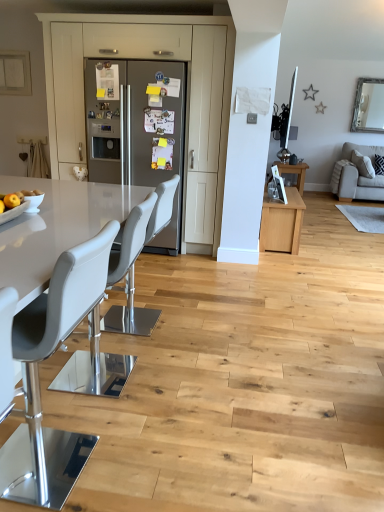
Question: Is white leather chair at center, the 1th chair viewed from the back, inside or outside of matte gray cabinet at center?

Choices:
 (A) inside
 (B) outside

Answer: (B)

Question: Considering the positions of point (120, 276) and point (228, 34), is point (120, 276) closer or farther from the camera than point (228, 34)?

Choices:
 (A) farther
 (B) closer

Answer: (B)

Question: Based on their relative distances, which object is nearer to the gray leather chair at left, which is the 3th chair from back to front?

Choices:
 (A) matte gray cabinet at center
 (B) gray leather bar stool at center, which is the second chair in back-to-front order
 (C) white leather chair at center, the 1th chair viewed from the back
 (D) wooden table at center
 (E) satin stainless steel refrigerator at center

Answer: (B)

Question: Which object is the closest to the beige fabric couch at right?

Choices:
 (A) satin stainless steel refrigerator at center
 (B) wooden table at center
 (C) white leather chair at center, positioned as the 3th chair in front-to-back order
 (D) matte gray cabinet at center
 (E) gray leather chair at left, which appears as the 1th chair when viewed from the front

Answer: (B)